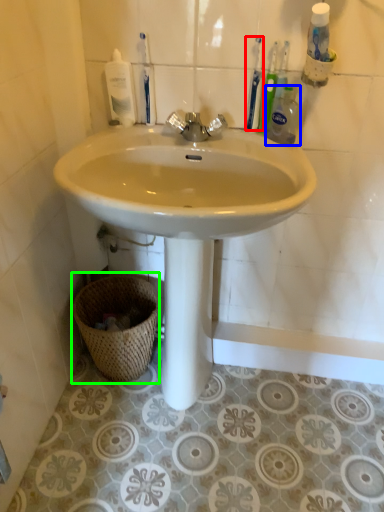
Question: Estimate the real-world distances between objects in this image. Which object is farther from toothbrush (highlighted by a red box), cleaning product (highlighted by a blue box) or basket (highlighted by a green box)?

Choices:
 (A) cleaning product
 (B) basket

Answer: (B)